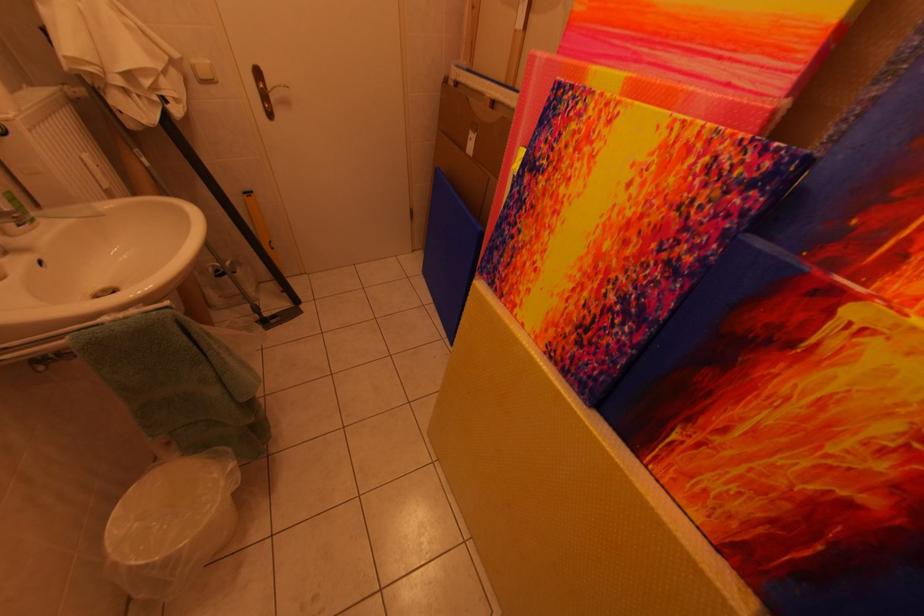
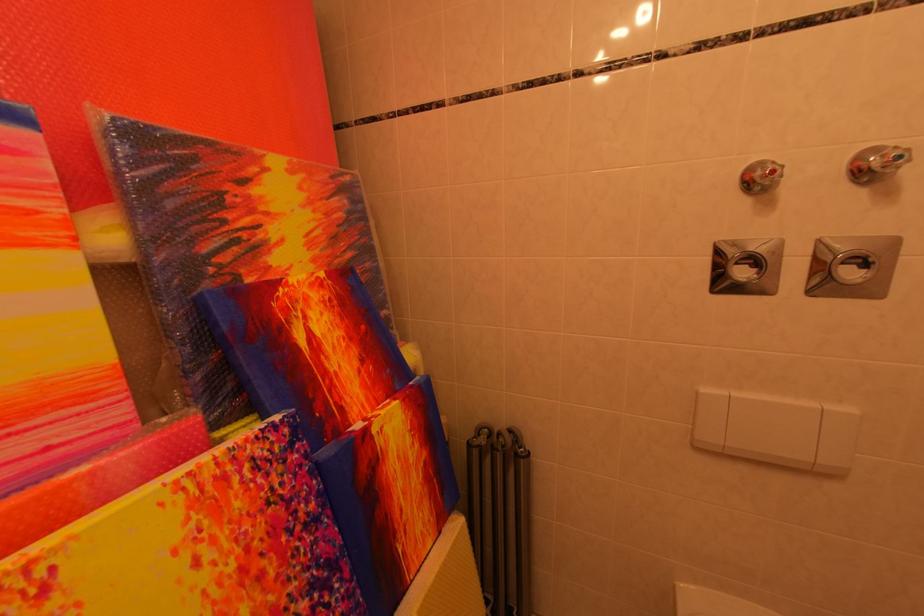
The point at (752, 217) is marked in the first image. Where is the corresponding point in the second image?

(313, 460)